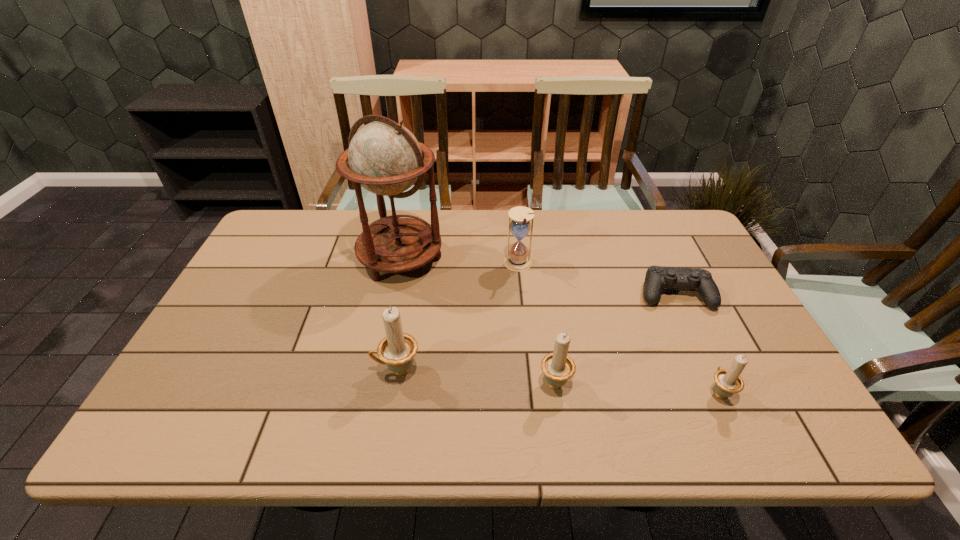
With all candle_holders evenly spaced, where should an extra candle_holder be placed on the left to continue the pattern? Please point out a vacant space. Please provide its 2D coordinates. Your answer should be formatted as a tuple, i.e. [(x, y)], where the tuple contains the x and y coordinates of a point satisfying the conditions above.

[(246, 360)]